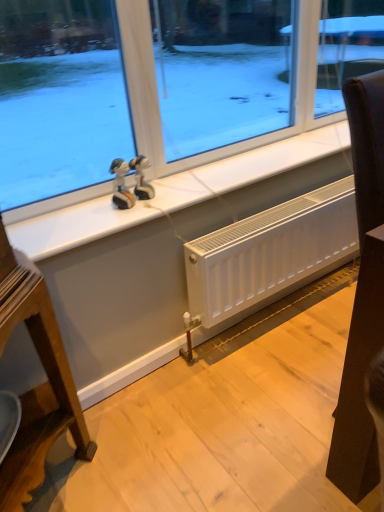
Question: From a real-world perspective, is glossy plastic figurine at upper center, marked as the second figurine in a left-to-right arrangement, located higher than matte plastic figurine at center, which ranks as the 1th figurine in left-to-right order?

Choices:
 (A) no
 (B) yes

Answer: (A)

Question: Is glossy plastic figurine at upper center, which is counted as the first figurine, starting from the right, further to the viewer compared to matte plastic figurine at center, which ranks as the 1th figurine in left-to-right order?

Choices:
 (A) yes
 (B) no

Answer: (A)

Question: Are glossy plastic figurine at upper center, which is counted as the first figurine, starting from the right, and matte plastic figurine at center, the second figurine from the right, far apart?

Choices:
 (A) no
 (B) yes

Answer: (A)

Question: Can you confirm if glossy plastic figurine at upper center, marked as the second figurine in a left-to-right arrangement, is taller than matte plastic figurine at center, the second figurine from the right?

Choices:
 (A) yes
 (B) no

Answer: (B)

Question: Would you say glossy plastic figurine at upper center, marked as the second figurine in a left-to-right arrangement, is outside matte plastic figurine at center, the second figurine from the right?

Choices:
 (A) yes
 (B) no

Answer: (A)

Question: Is glossy plastic figurine at upper center, marked as the second figurine in a left-to-right arrangement, aimed at matte plastic figurine at center, which ranks as the 1th figurine in left-to-right order?

Choices:
 (A) yes
 (B) no

Answer: (B)

Question: Can we say glossy plastic figurine at upper center, marked as the second figurine in a left-to-right arrangement, lies outside white tile at upper center?

Choices:
 (A) no
 (B) yes

Answer: (B)

Question: Is glossy plastic figurine at upper center, marked as the second figurine in a left-to-right arrangement, looking in the opposite direction of white tile at upper center?

Choices:
 (A) yes
 (B) no

Answer: (B)

Question: Is glossy plastic figurine at upper center, marked as the second figurine in a left-to-right arrangement, to the left of white tile at upper center from the viewer's perspective?

Choices:
 (A) no
 (B) yes

Answer: (B)

Question: Can you confirm if glossy plastic figurine at upper center, marked as the second figurine in a left-to-right arrangement, is bigger than white tile at upper center?

Choices:
 (A) no
 (B) yes

Answer: (A)

Question: Can you confirm if glossy plastic figurine at upper center, which is counted as the first figurine, starting from the right, is taller than white tile at upper center?

Choices:
 (A) yes
 (B) no

Answer: (A)

Question: From the image's perspective, is glossy plastic figurine at upper center, which is counted as the first figurine, starting from the right, located above white tile at upper center?

Choices:
 (A) yes
 (B) no

Answer: (B)

Question: Can white matte radiator at lower center be found inside glossy plastic figurine at upper center, which is counted as the first figurine, starting from the right?

Choices:
 (A) no
 (B) yes

Answer: (A)